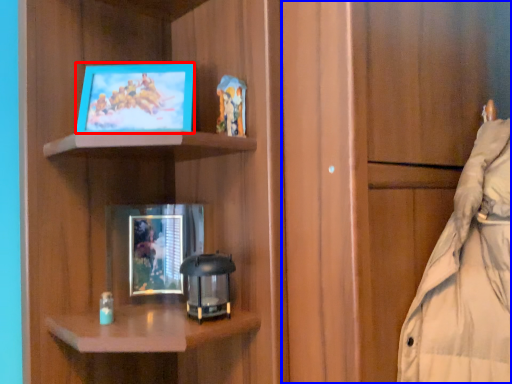
Question: Which of the following is the farthest to the observer, picture frame (highlighted by a red box) or cabinetry (highlighted by a blue box)?

Choices:
 (A) picture frame
 (B) cabinetry

Answer: (A)